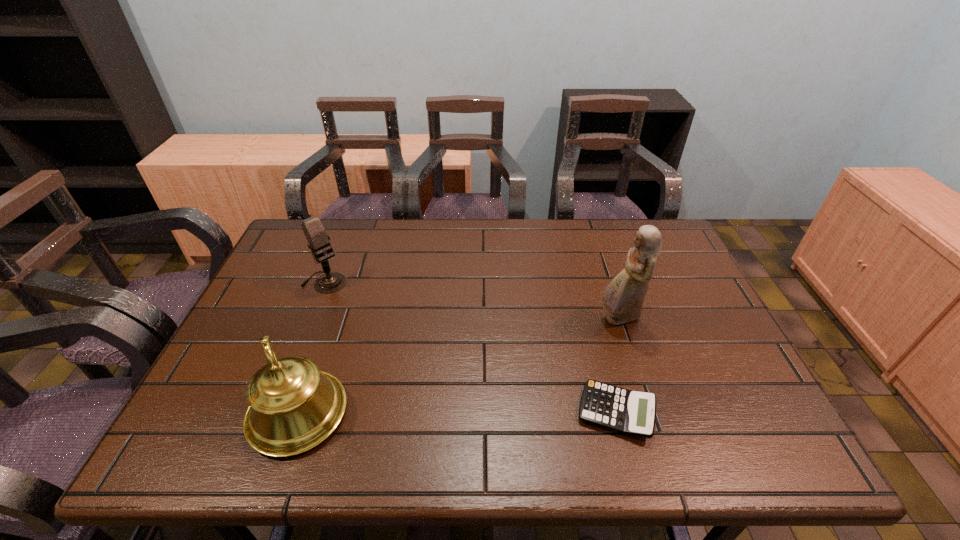
This screenshot has height=540, width=960. Find the location of `vacant space located on the front-facing side of the farthest object`. vacant space located on the front-facing side of the farthest object is located at coordinates (404, 353).

The width and height of the screenshot is (960, 540). In order to click on free location located 0.310m on the front-facing side of the farthest object in this screenshot , I will do `click(402, 351)`.

The height and width of the screenshot is (540, 960). I want to click on vacant space situated on the front-facing side of the farthest object, so click(x=376, y=327).

Where is `bell present at the near edge`? The height and width of the screenshot is (540, 960). bell present at the near edge is located at coordinates (293, 406).

In order to click on calculator present at the near edge in this screenshot , I will do `click(629, 412)`.

This screenshot has width=960, height=540. I want to click on bell at the left edge, so click(293, 406).

Locate an element on the screen. The image size is (960, 540). microphone that is at the left edge is located at coordinates (315, 233).

Locate an element on the screen. The height and width of the screenshot is (540, 960). object at the near left corner is located at coordinates (293, 406).

You are a GUI agent. You are given a task and a screenshot of the screen. Output one action in this format:
    pyautogui.click(x=<x>, y=<y>)
    Task: Click on the vacant space at the far edge of the desktop
    This screenshot has width=960, height=540.
    Given the screenshot: What is the action you would take?
    pyautogui.click(x=396, y=253)

You are a GUI agent. You are given a task and a screenshot of the screen. Output one action in this format:
    pyautogui.click(x=<x>, y=<y>)
    Task: Click on the free space at the left edge
    The image size is (960, 540).
    Given the screenshot: What is the action you would take?
    pyautogui.click(x=301, y=272)